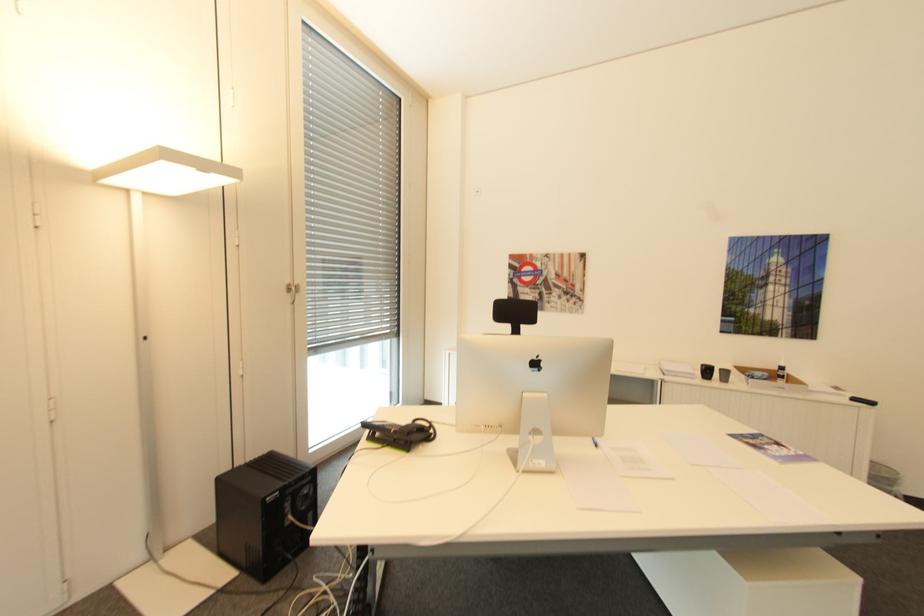
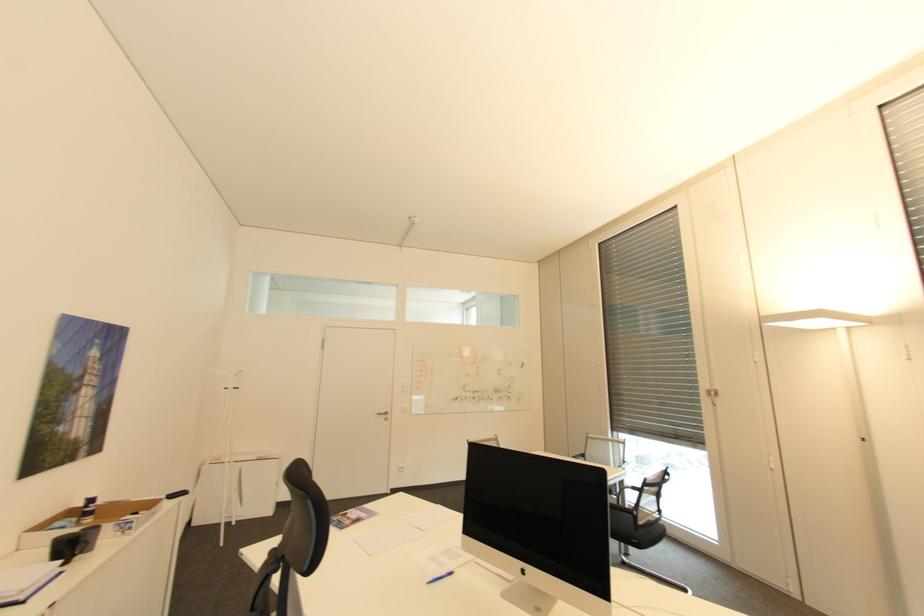
The point at [878,403] is marked in the first image. Where is the corresponding point in the second image?

(188, 493)